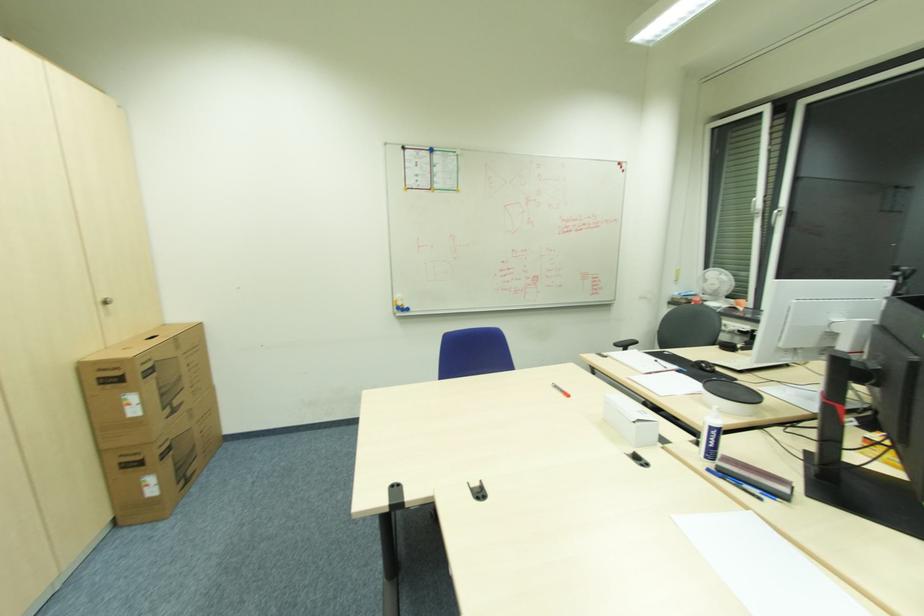
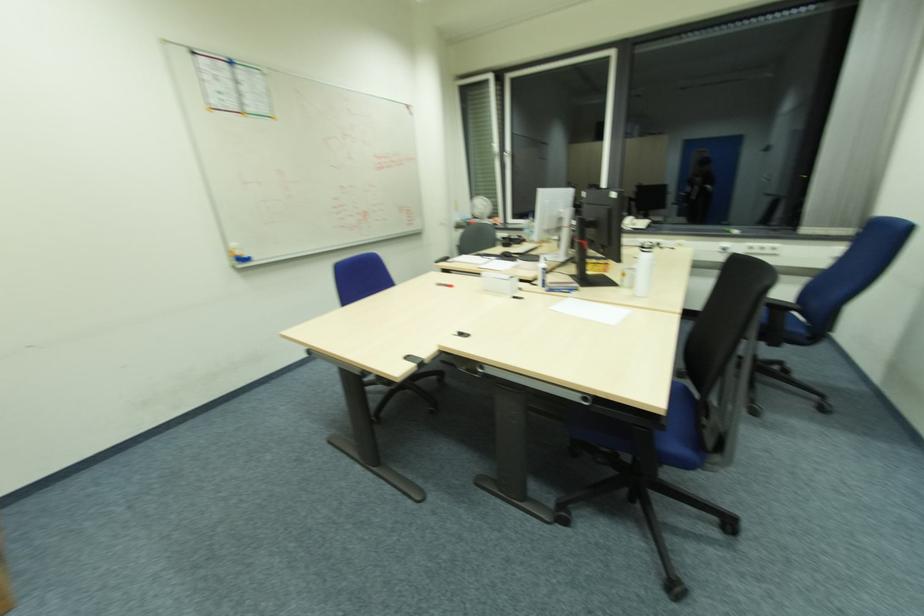
Question: The camera is either moving clockwise (left) or counter-clockwise (right) around the object. The first image is from the beginning of the video and the second image is from the end. Is the camera moving left or right when shooting the video?

Choices:
 (A) Left
 (B) Right

Answer: (A)